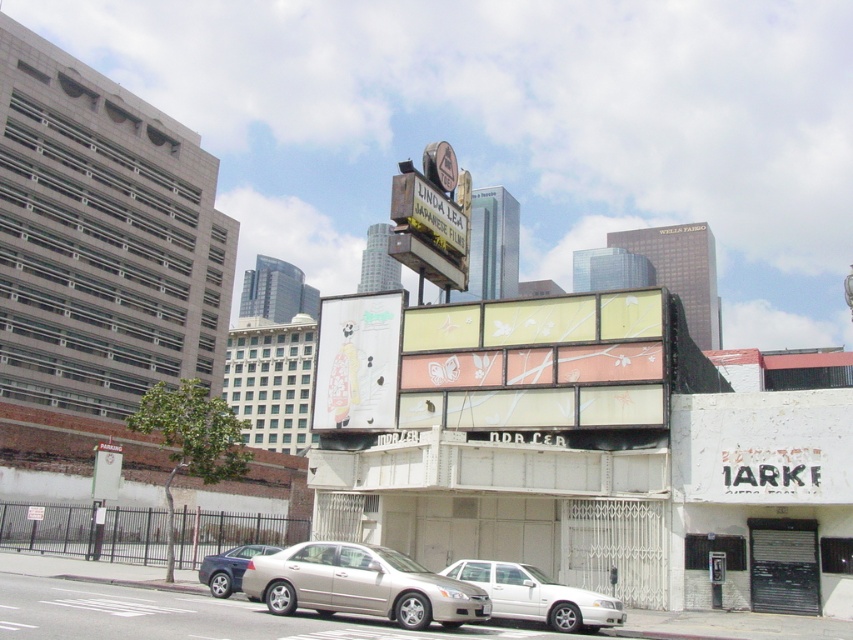
Question: Is metallic silver sedan at center to the left of silver metallic sedan at lower center from the viewer's perspective?

Choices:
 (A) yes
 (B) no

Answer: (A)

Question: Does silver metallic sedan at lower center have a larger size compared to silver metallic sedan at lower left?

Choices:
 (A) no
 (B) yes

Answer: (A)

Question: Which point is closer to the camera?

Choices:
 (A) silver metallic sedan at lower left
 (B) silver metallic sedan at lower center
 (C) metallic silver sedan at center

Answer: (C)

Question: Which of these objects is positioned farthest from the silver metallic sedan at lower center?

Choices:
 (A) silver metallic sedan at lower left
 (B) metallic silver sedan at center

Answer: (A)

Question: Does metallic silver sedan at center appear under silver metallic sedan at lower left?

Choices:
 (A) no
 (B) yes

Answer: (A)

Question: Which of these objects is positioned closest to the silver metallic sedan at lower left?

Choices:
 (A) silver metallic sedan at lower center
 (B) metallic silver sedan at center

Answer: (B)